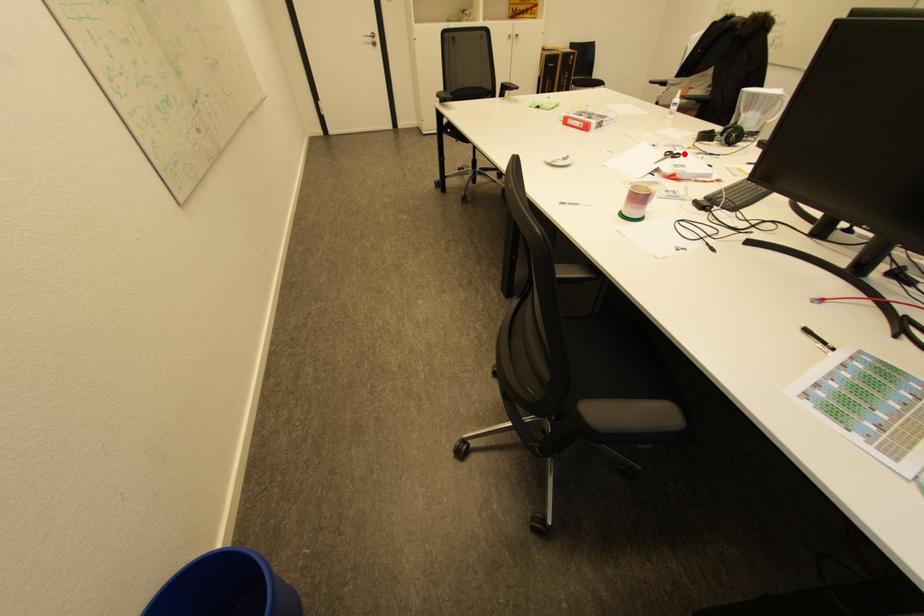
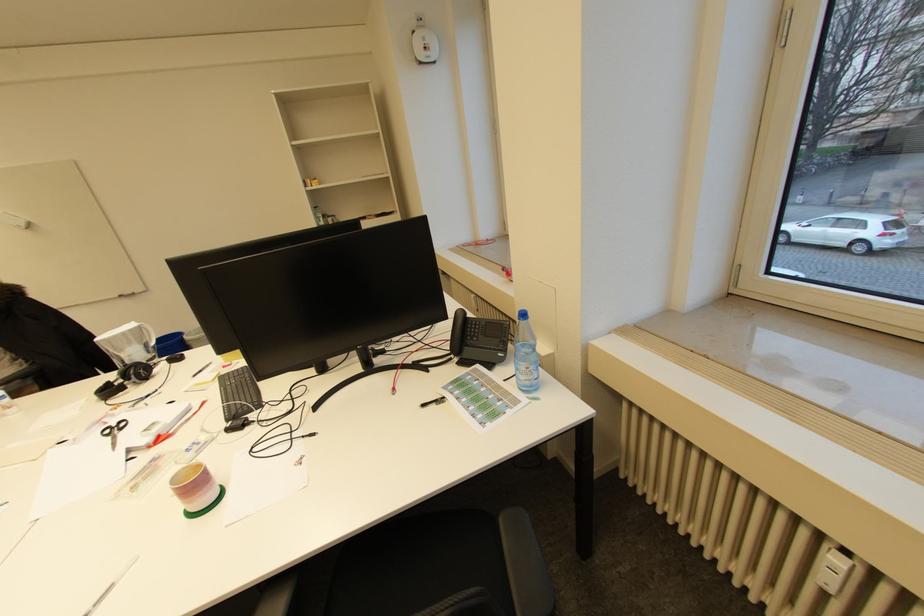
Question: I am providing you with two images of the same scene from different viewpoints. A red point is marked on the first image. Is the red point's position out of view in image 2?

Choices:
 (A) Yes
 (B) No

Answer: (B)